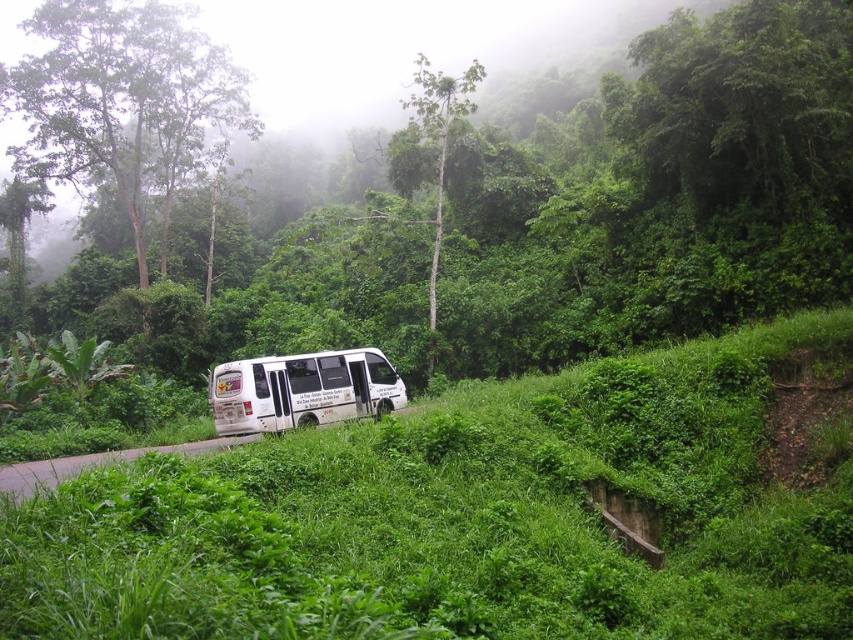
Can you confirm if green leafy tree at center is bigger than white matte van at center?

Correct, green leafy tree at center is larger in size than white matte van at center.

Is point (428, 365) less distant than point (299, 358)?

No.

At what (x,y) coordinates should I click in order to perform the action: click on green leafy tree at center. Please return your answer as a coordinate pair (x, y). The image size is (853, 640). Looking at the image, I should click on tap(479, 211).

Can you confirm if green leafy tree at upper left is positioned above green smooth tree at upper center?

No.

Is green leafy tree at upper left further to the viewer compared to green smooth tree at upper center?

That is True.

At what (x,y) coordinates should I click in order to perform the action: click on green leafy tree at upper left. Please return your answer as a coordinate pair (x, y). This screenshot has width=853, height=640. Looking at the image, I should click on (122, 104).

Can you confirm if green leafy tree at upper left is positioned below white matte van at center?

Incorrect, green leafy tree at upper left is not positioned below white matte van at center.

How far apart are green leafy tree at upper left and white matte van at center?

green leafy tree at upper left is 145.31 feet from white matte van at center.

Between point (213, 84) and point (247, 388), which one is positioned in front?

Point (247, 388)

Where is `green leafy tree at upper left`? green leafy tree at upper left is located at coordinates [x=122, y=104].